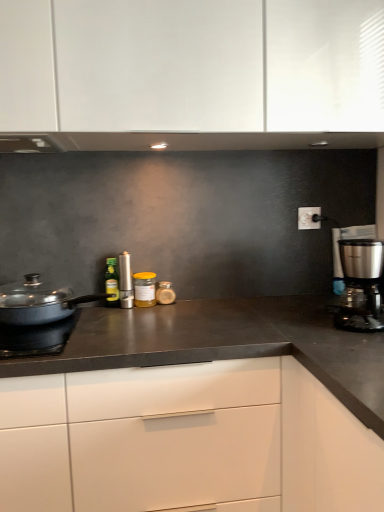
At what (x,y) coordinates should I click in order to perform the action: click on vacant space in front of satin silver canister at center, the fourth kitchen appliance viewed from the right. Please return your answer as a coordinate pair (x, y). The height and width of the screenshot is (512, 384). Looking at the image, I should click on (121, 318).